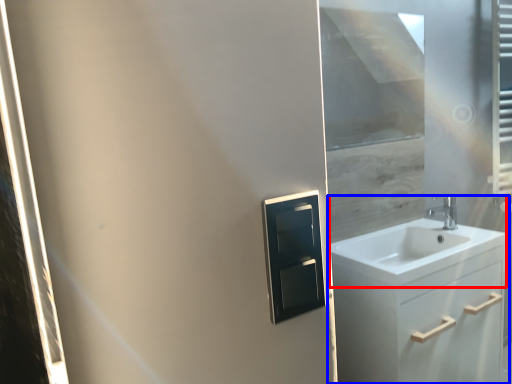
Question: Which object appears farthest to the camera in this image, sink (highlighted by a red box) or bathroom cabinet (highlighted by a blue box)?

Choices:
 (A) sink
 (B) bathroom cabinet

Answer: (A)